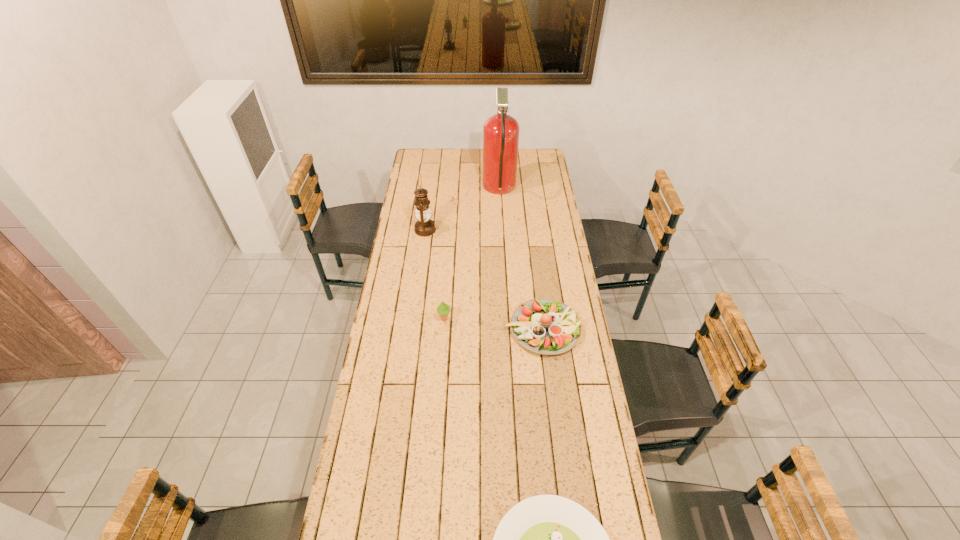
Find the location of a particular element. This screenshot has width=960, height=540. vacant region that satisfies the following two spatial constraints: 1. with the handle and nozzle on the tallest object; 2. on the front side of the fourth nearest object is located at coordinates (502, 230).